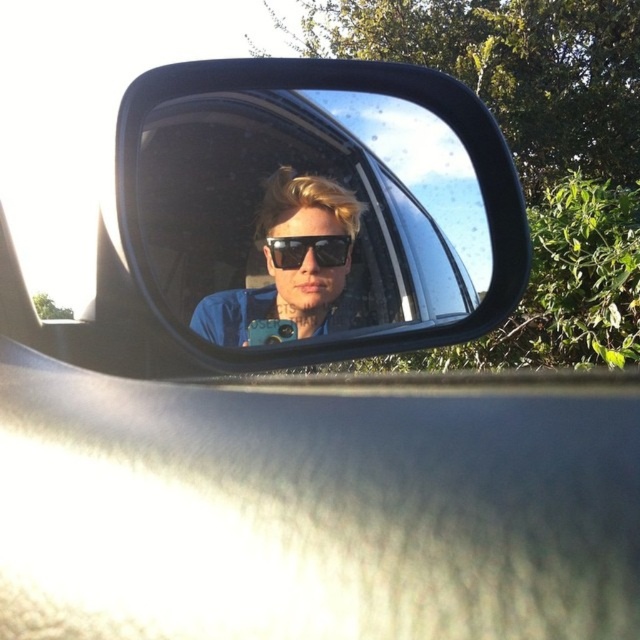
Question: Is the position of black plastic mirror at center more distant than that of sunglasses at center?

Choices:
 (A) no
 (B) yes

Answer: (A)

Question: Considering the relative positions of black plastic mirror at center and black plastic sunglasses at center in the image provided, where is black plastic mirror at center located with respect to black plastic sunglasses at center?

Choices:
 (A) above
 (B) below

Answer: (A)

Question: Estimate the real-world distances between objects in this image. Which object is farther from the sunglasses at center?

Choices:
 (A) black plastic sunglasses at center
 (B) black plastic mirror at center

Answer: (B)

Question: Which is farther from the black plastic sunglasses at center?

Choices:
 (A) sunglasses at center
 (B) black plastic mirror at center

Answer: (B)

Question: Which object appears farthest from the camera in this image?

Choices:
 (A) black plastic mirror at center
 (B) sunglasses at center

Answer: (B)

Question: Where is black plastic mirror at center located in relation to black plastic sunglasses at center in the image?

Choices:
 (A) left
 (B) right

Answer: (B)